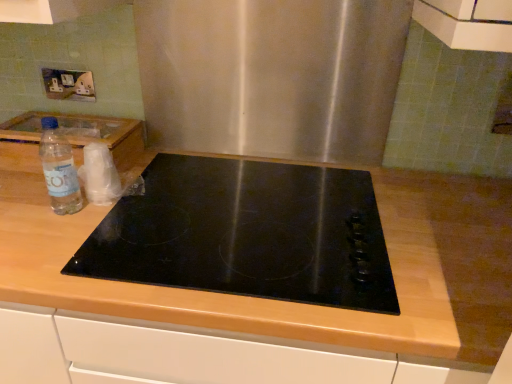
Identify the location of free space to the left of clear plastic bottle at left. (24, 195).